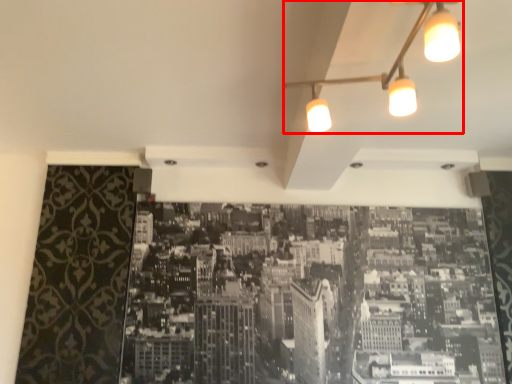
Question: From the image's perspective, what is the correct spatial positioning of lamp (annotated by the red box) in reference to hotel?

Choices:
 (A) above
 (B) below

Answer: (A)